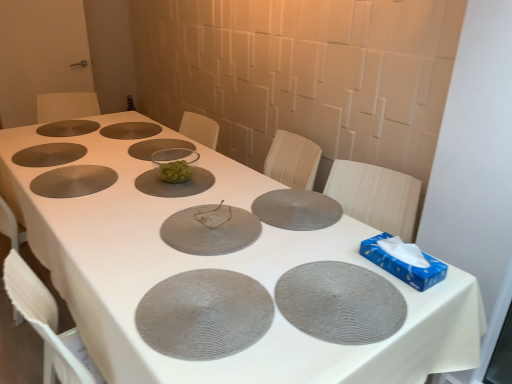
Find the location of a particular element. The height and width of the screenshot is (384, 512). free space that is in between gray textured placemat at center, positioned as the 10th glass plate in back-to-front order, and matte gray glass plate at upper left, placed as the first glass plate when sorted from back to front is located at coordinates (109, 195).